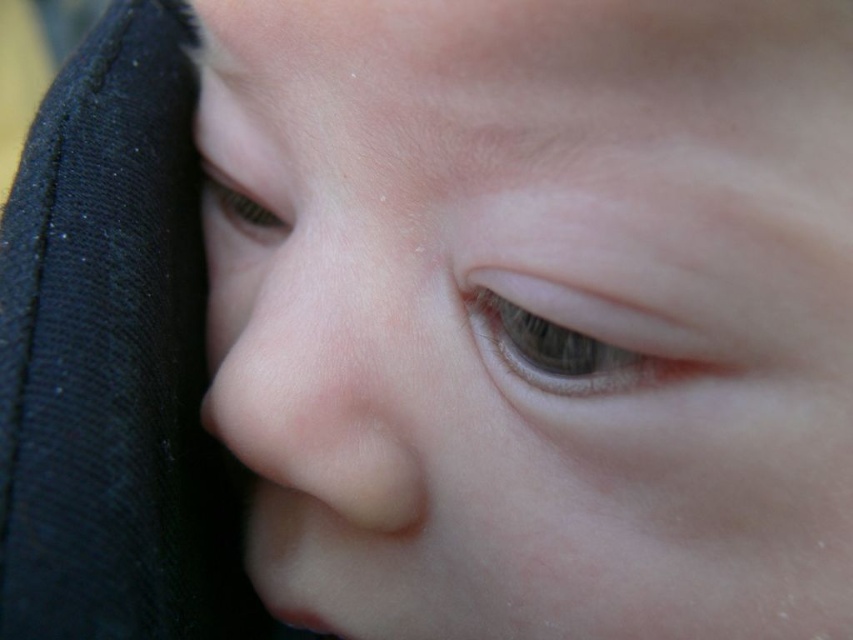
Question: Is smooth skin nose at center thinner than matte skin eye at upper left?

Choices:
 (A) yes
 (B) no

Answer: (B)

Question: Which point appears closest to the camera in this image?

Choices:
 (A) (288, 230)
 (B) (467, 298)
 (C) (215, 268)

Answer: (B)

Question: Observing the image, what is the correct spatial positioning of smooth skin nose at center in reference to brown matte eye at center?

Choices:
 (A) below
 (B) above

Answer: (A)

Question: Does smooth skin nose at center appear over brown matte eye at center?

Choices:
 (A) yes
 (B) no

Answer: (B)

Question: Which object is farther from the camera taking this photo?

Choices:
 (A) brown matte eye at center
 (B) smooth skin nose at center
 (C) matte skin eye at upper left

Answer: (C)

Question: Among these objects, which one is farthest from the camera?

Choices:
 (A) smooth skin nose at center
 (B) brown matte eye at center

Answer: (A)